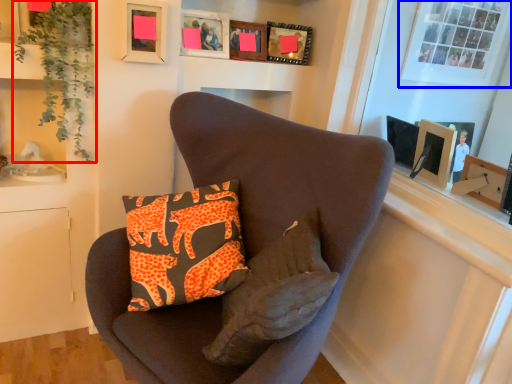
Question: Which of the following is the closest to the observer, plant (highlighted by a red box) or bay window (highlighted by a blue box)?

Choices:
 (A) plant
 (B) bay window

Answer: (A)